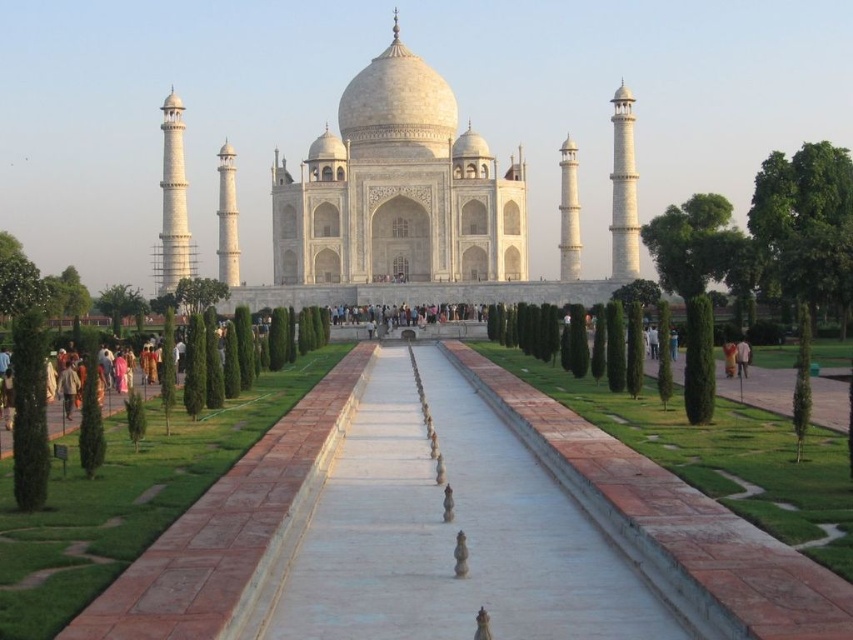
Consider the image. Which is above, smooth stone pathway at center or white marble taj mahal at center?

white marble taj mahal at center

Is smooth stone pathway at center below white marble taj mahal at center?

Yes.

Who is more forward, (525, 577) or (364, 157)?

Positioned in front is point (525, 577).

Where is `smooth stone pathway at center`? smooth stone pathway at center is located at coordinates (445, 531).

Is white marble taj mahal at center above white cotton dress at center?

Yes, white marble taj mahal at center is above white cotton dress at center.

Who is more forward, (439,269) or (648,340)?

Point (648,340) is in front.

Find the location of a particular element. The image size is (853, 640). white marble taj mahal at center is located at coordinates (387, 202).

Does point (466, 308) lie behind point (724, 364)?

Yes.

Is point (410, 307) positioned in front of point (727, 356)?

No.

You are a GUI agent. You are given a task and a screenshot of the screen. Output one action in this format:
    pyautogui.click(x=<x>, y=<y>)
    Task: Click on the dark brown wooden bench at center
    The width and height of the screenshot is (853, 640).
    Given the screenshot: What is the action you would take?
    pyautogui.click(x=409, y=314)